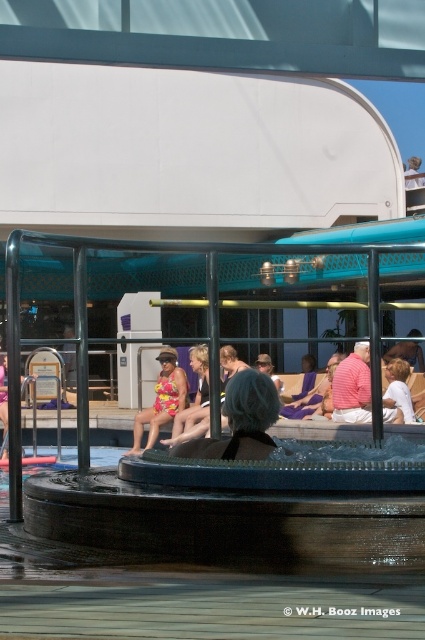
Question: Which point is farther to the camera?

Choices:
 (A) (274, 380)
 (B) (265, 404)
 (C) (206, 401)
 (D) (399, 362)

Answer: (C)

Question: Which object is the closest to the red shirt at center?

Choices:
 (A) white cotton shirt at center
 (B) multicolored swimsuit at center
 (C) floral swimsuit at center

Answer: (A)

Question: Is yellow swimsuit at center further to the viewer compared to white fabric hat at upper center?

Choices:
 (A) yes
 (B) no

Answer: (B)

Question: Is floral swimsuit at center positioned behind matte yellow swimsuit at center?

Choices:
 (A) yes
 (B) no

Answer: (A)

Question: Which point is farther to the camera?

Choices:
 (A) (248, 442)
 (B) (404, 404)
 (C) (422, 180)

Answer: (C)

Question: In this image, where is red shirt at center located relative to white cotton shirt at center?

Choices:
 (A) above
 (B) below

Answer: (B)